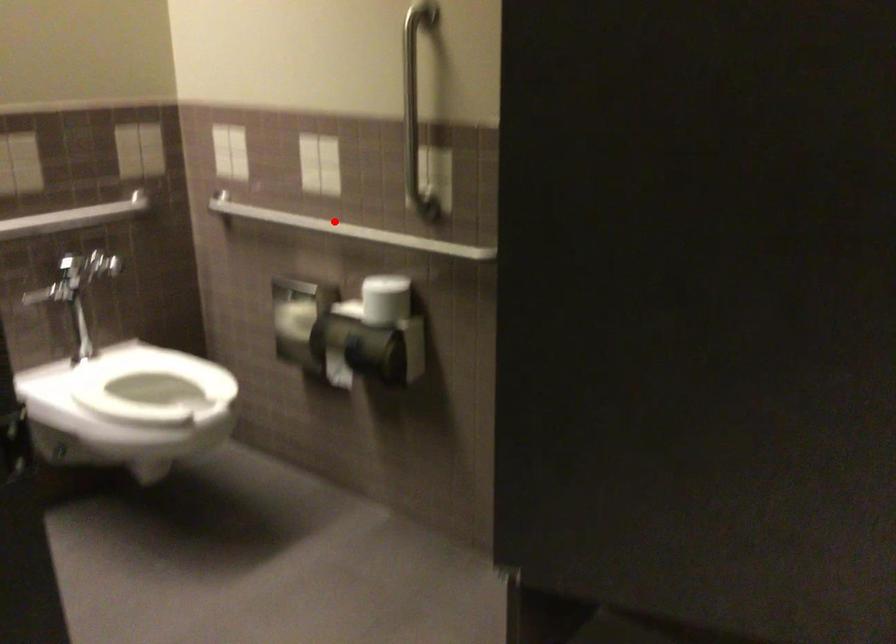
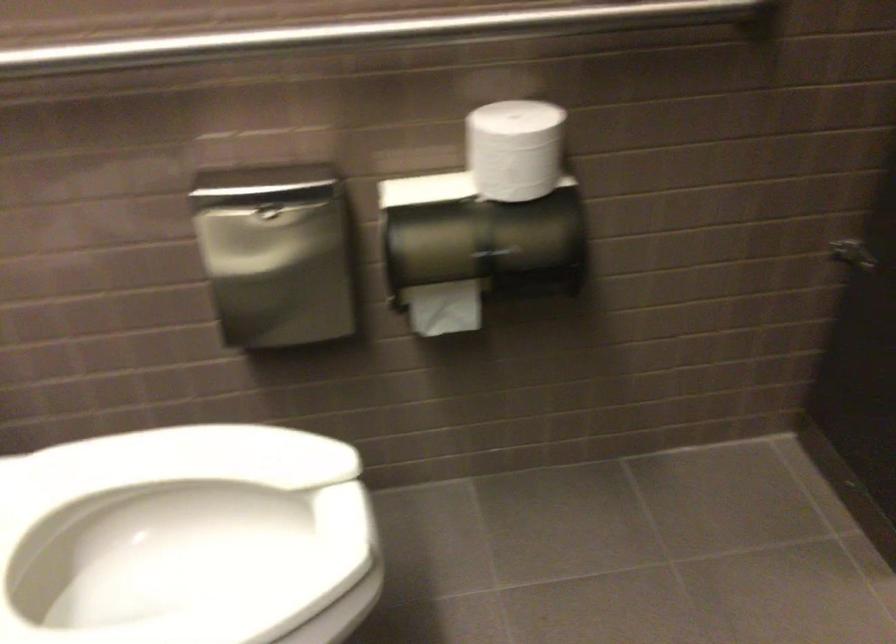
The point at the highlighted location is marked in the first image. Where is the corresponding point in the second image?

(368, 33)